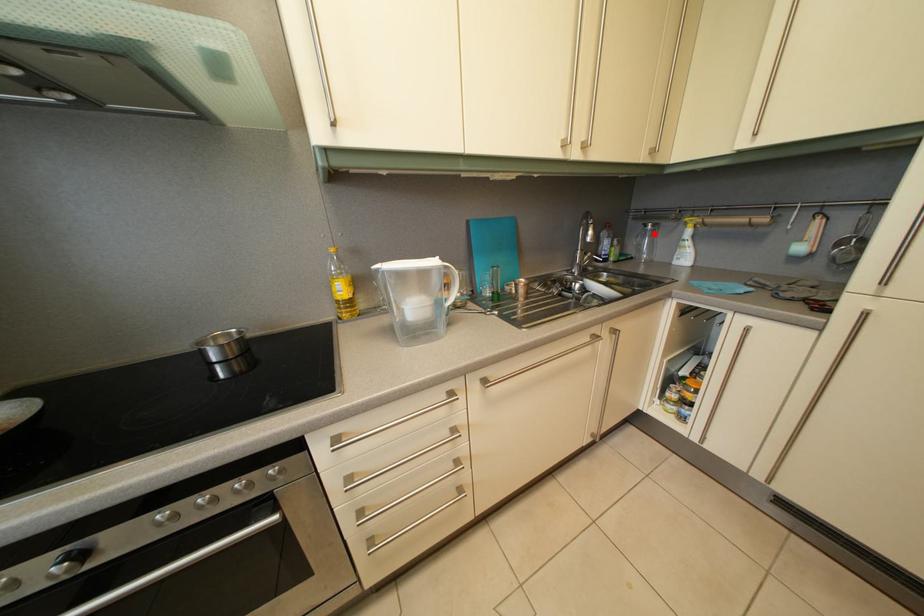
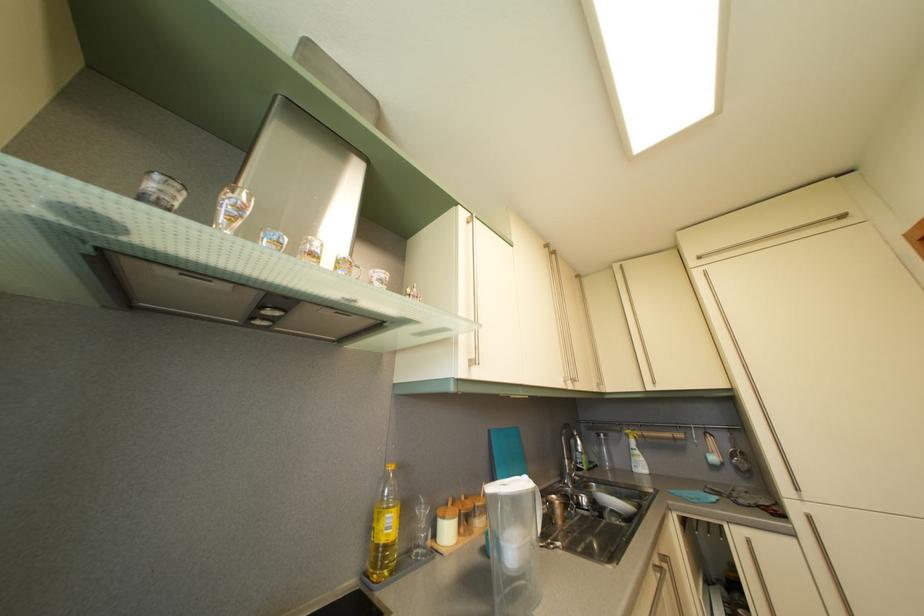
Locate, in the second image, the point that corresponds to the highlighted location in the first image.

(608, 444)